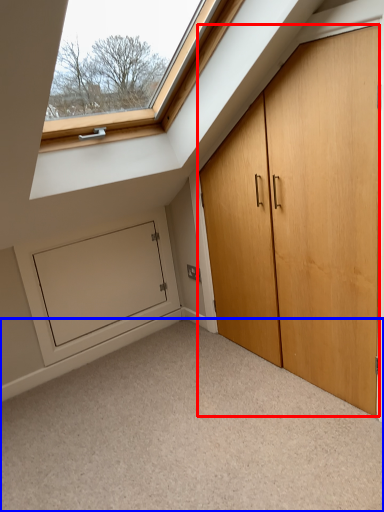
Question: Which of the following is the farthest to the observer, door (highlighted by a red box) or corridor (highlighted by a blue box)?

Choices:
 (A) door
 (B) corridor

Answer: (A)